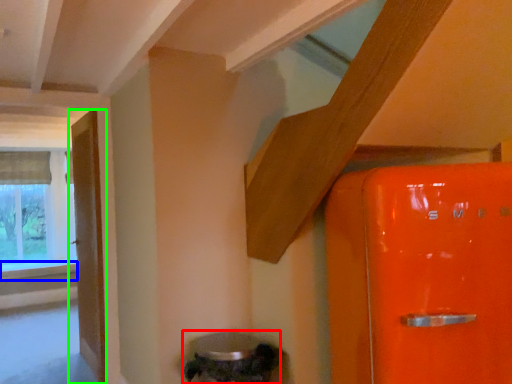
Question: Which is nearer to the water heater (highlighted by a red box)? window sill (highlighted by a blue box) or door (highlighted by a green box).

Choices:
 (A) window sill
 (B) door

Answer: (B)